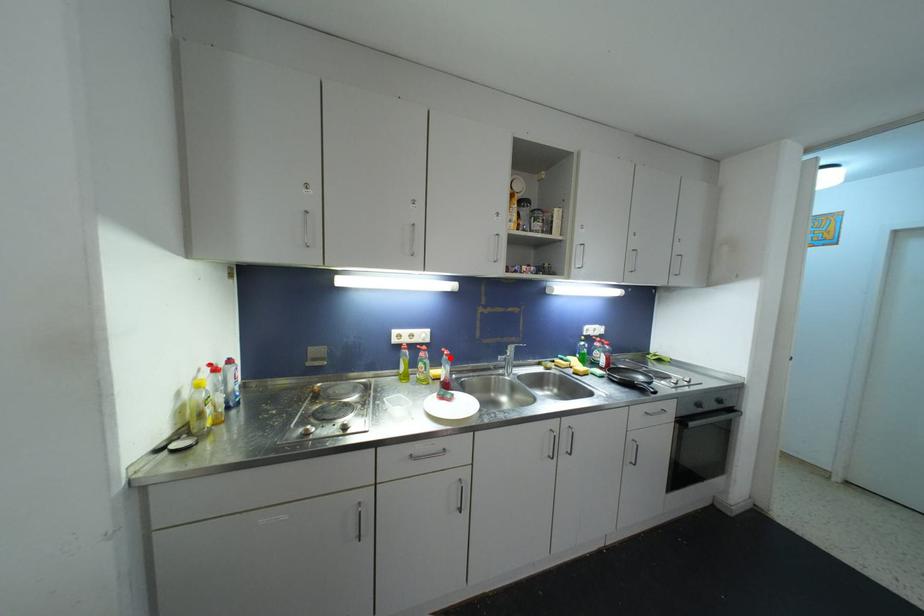
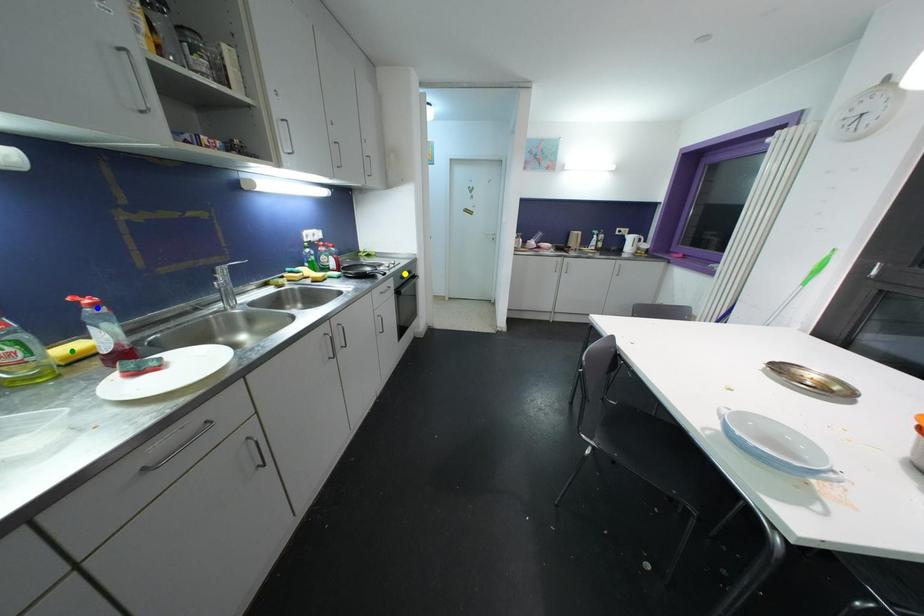
Question: I am providing you with two images of the same scene from different viewpoints. A red point is marked on the first image. You are given multiple points on the second image. Which point in image 2 is actually the same real-world point as the red point in image 1?

Choices:
 (A) green point
 (B) blue point
 (C) yellow point

Answer: (B)